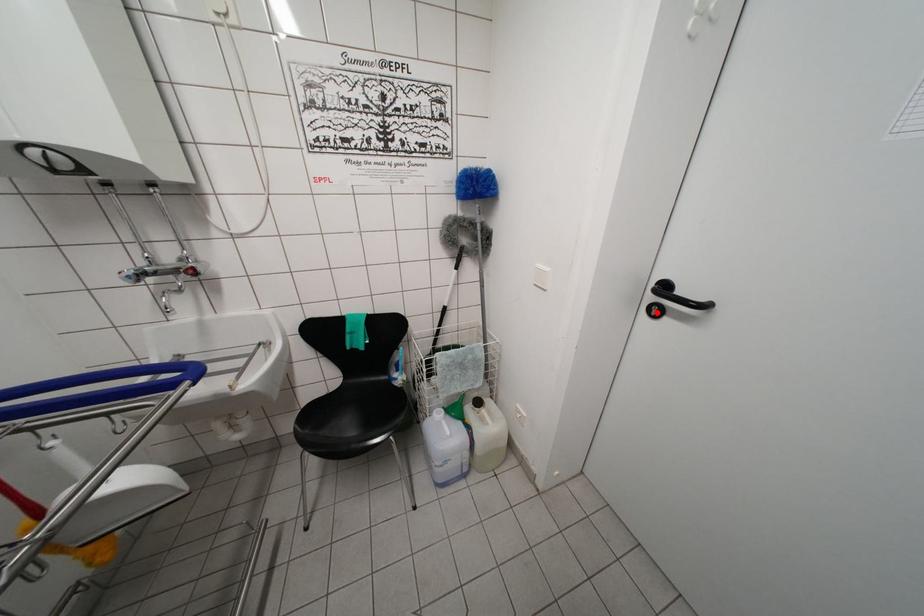
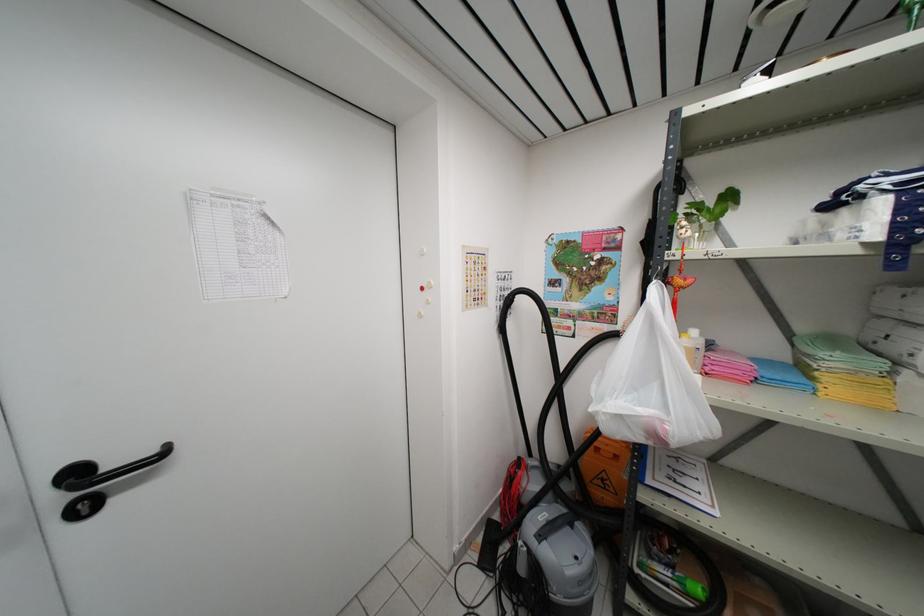
Where in the second image is the point corresponding to the highlighted location from the first image?

(83, 512)